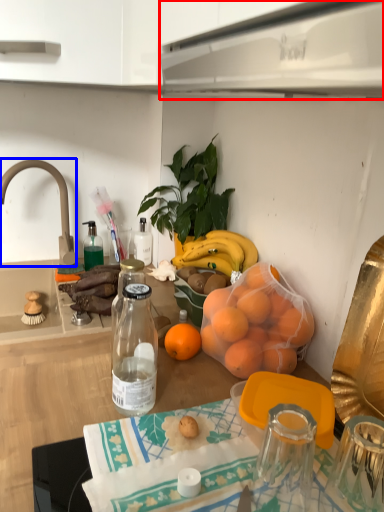
Question: Among these objects, which one is farthest to the camera, kitchen appliance (highlighted by a red box) or faucet (highlighted by a blue box)?

Choices:
 (A) kitchen appliance
 (B) faucet

Answer: (B)